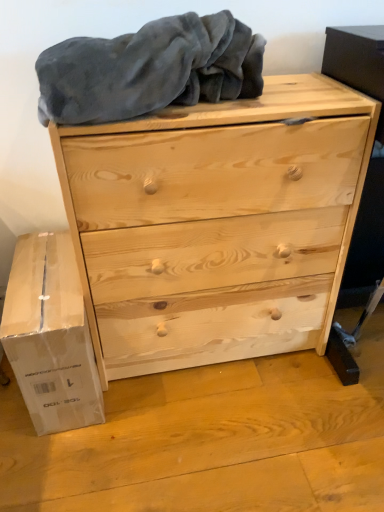
At what (x,y) coordinates should I click in order to perform the action: click on free space between natural wood chest of drawers at center and white cardboard box at lower left. Please return your answer as a coordinate pair (x, y). Looking at the image, I should click on (182, 402).